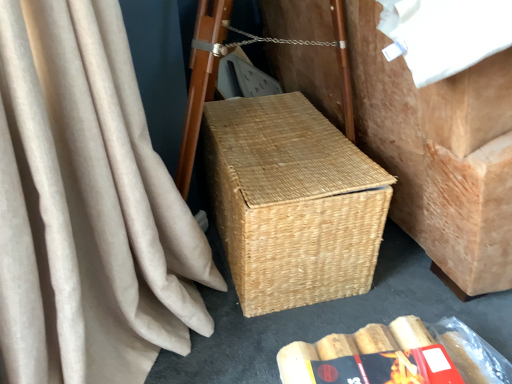
Identify the location of free point above woven brown basket at center (from a real-world perspective). (376, 357).